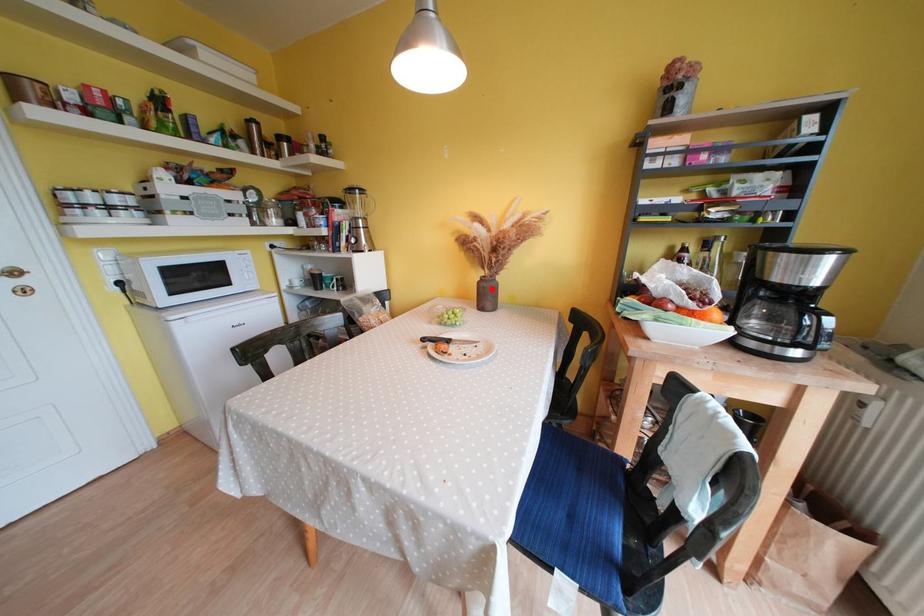
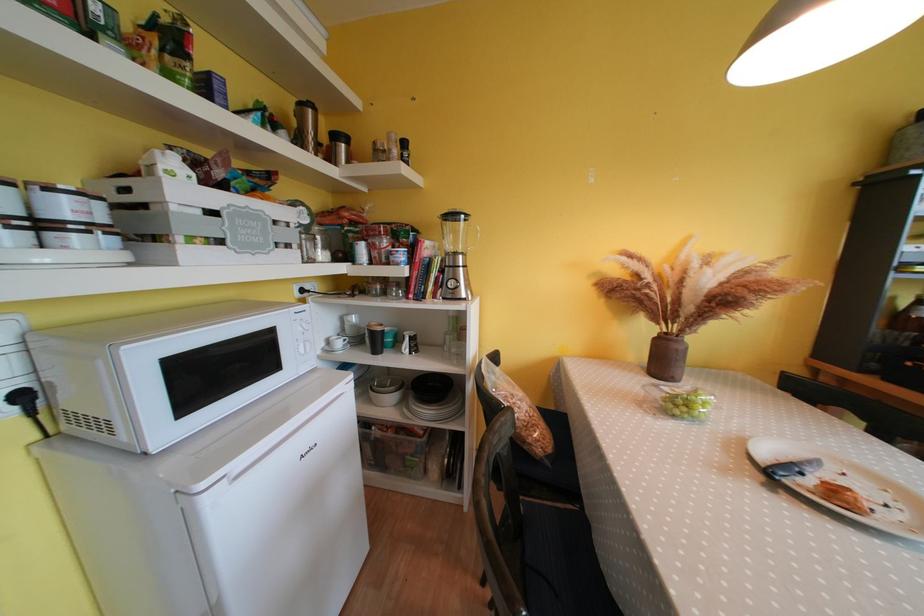
Find the pixel in the second image that matches the highlighted location in the first image.

(687, 351)